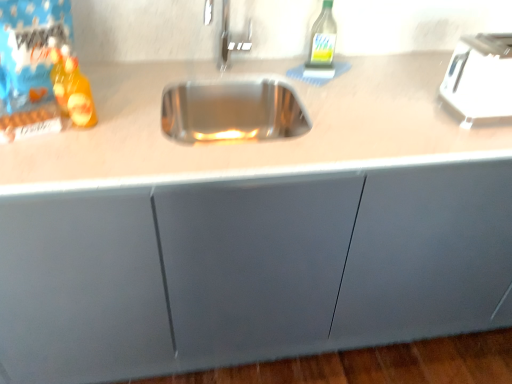
Locate an element on the screen. The image size is (512, 384). free space behind white plastic toaster at upper right is located at coordinates coord(420,77).